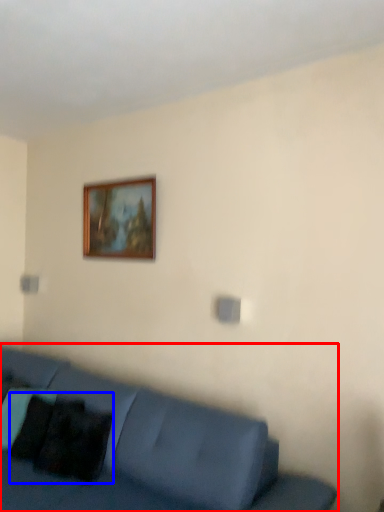
Question: Which object appears closest to the camera in this image, studio couch (highlighted by a red box) or pillow (highlighted by a blue box)?

Choices:
 (A) studio couch
 (B) pillow

Answer: (A)